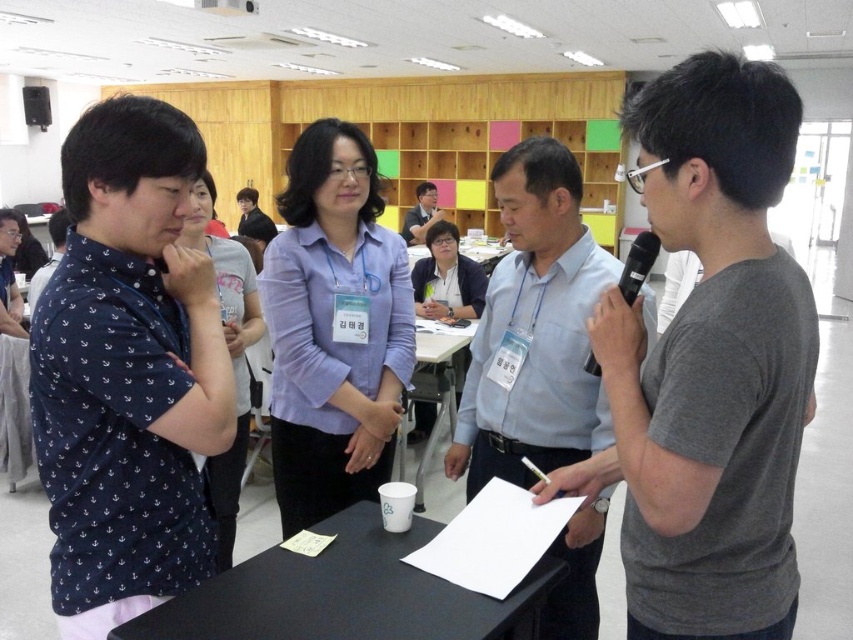
Question: Can you confirm if purple cotton shirt at center is thinner than white paper at center?

Choices:
 (A) no
 (B) yes

Answer: (B)

Question: Which point appears closest to the camera in this image?

Choices:
 (A) (764, 496)
 (B) (631, 282)

Answer: (A)

Question: Observing the image, what is the correct spatial positioning of black matte table at center in reference to black plastic microphone at right?

Choices:
 (A) below
 (B) above

Answer: (A)

Question: Can you confirm if gray matte t-shirt at center is positioned to the left of black plastic microphone at right?

Choices:
 (A) yes
 (B) no

Answer: (B)

Question: Among these points, which one is nearest to the camera?

Choices:
 (A) click(x=381, y=378)
 (B) click(x=497, y=250)

Answer: (A)

Question: Which of these objects is positioned closest to the gray matte t-shirt at center?

Choices:
 (A) black plastic microphone at right
 (B) light blue shirt at center
 (C) white paper at center

Answer: (A)